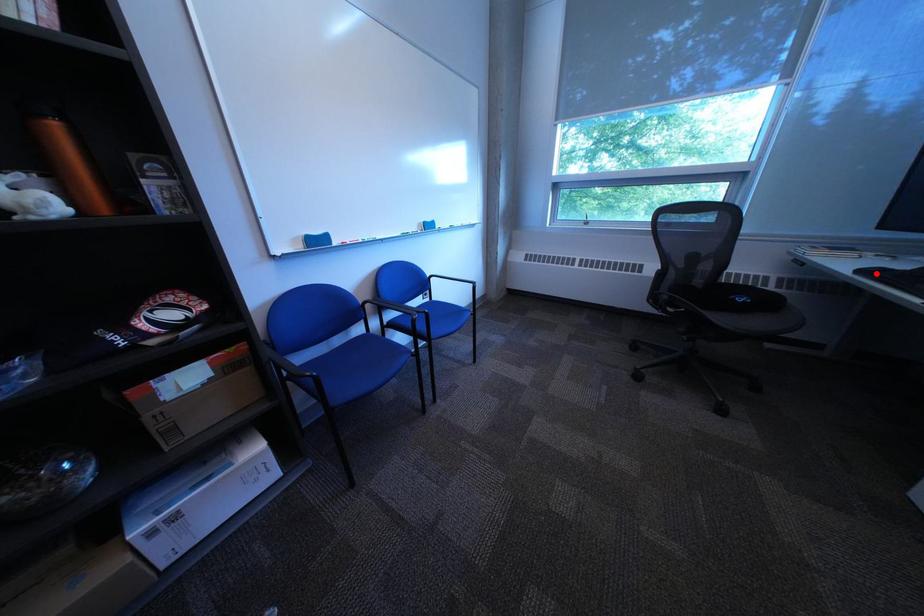
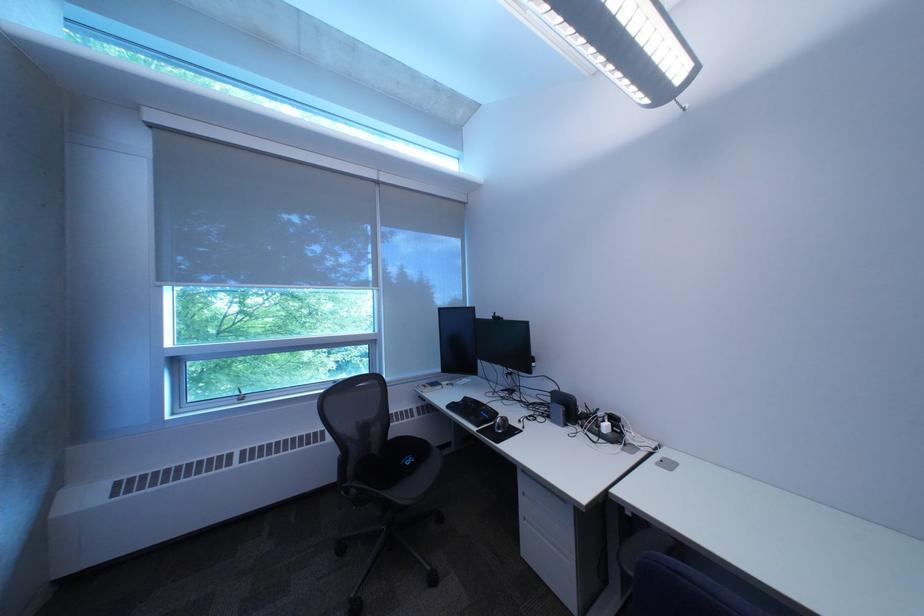
Where in the second image is the point corresponding to the highlighted location from the first image?

(464, 408)